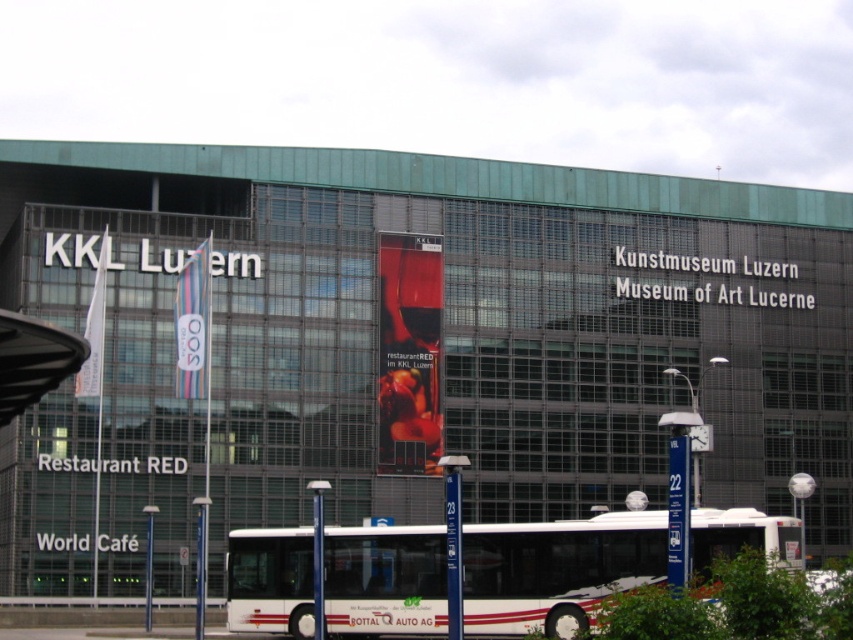
Question: Which point is closer to the camera?

Choices:
 (A) (795, 557)
 (B) (192, 298)

Answer: (A)

Question: Is white metallic bus at center closer to the viewer compared to white fabric flag at center?

Choices:
 (A) no
 (B) yes

Answer: (B)

Question: Is white fabric flag at center thinner than matte glass billboard at center?

Choices:
 (A) no
 (B) yes

Answer: (B)

Question: Which object is the farthest from the white fabric flag at center?

Choices:
 (A) matte glass billboard at center
 (B) matte glass banner at center

Answer: (A)

Question: Which point is farther to the camera?

Choices:
 (A) white metallic bus at center
 (B) white fabric flag at center

Answer: (B)

Question: Can you confirm if matte glass banner at center is positioned to the left of matte glass billboard at center?

Choices:
 (A) yes
 (B) no

Answer: (A)